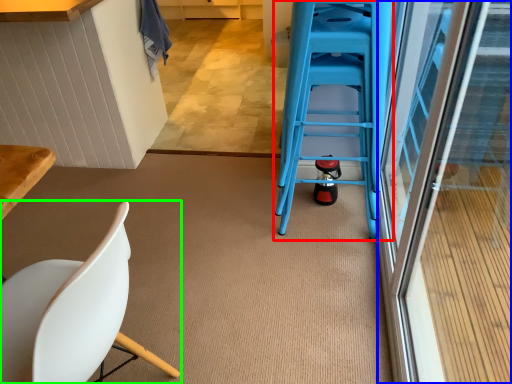
Question: Which object is positioned closest to ladder (highlighted by a red box)? Select from screen door (highlighted by a blue box) and chair (highlighted by a green box).

Choices:
 (A) screen door
 (B) chair

Answer: (A)